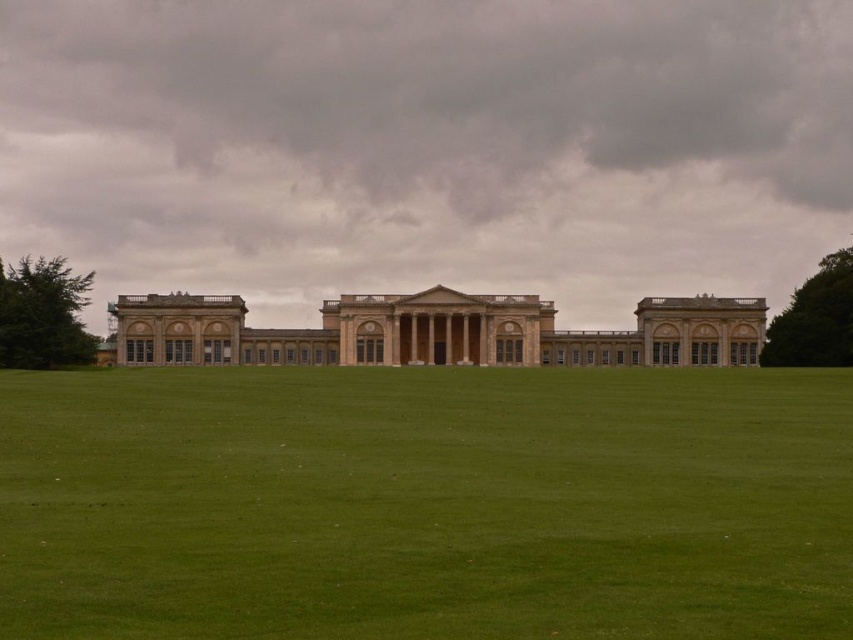
Question: Is the position of green grass at center less distant than that of beige stone mansion at center?

Choices:
 (A) yes
 (B) no

Answer: (A)

Question: In this image, where is green grass at center located relative to green leafy tree at right?

Choices:
 (A) below
 (B) above

Answer: (A)

Question: Which is farther from the green leafy tree at left?

Choices:
 (A) green leafy tree at right
 (B) beige stone mansion at center
 (C) green grass at center

Answer: (A)

Question: Based on their relative distances, which object is farther from the green leafy tree at left?

Choices:
 (A) beige stone mansion at center
 (B) green grass at center
 (C) green leafy tree at right

Answer: (C)

Question: Where is beige stone mansion at center located in relation to green leafy tree at right in the image?

Choices:
 (A) right
 (B) left

Answer: (B)

Question: Which object is farther from the camera taking this photo?

Choices:
 (A) beige stone mansion at center
 (B) green leafy tree at right
 (C) green grass at center

Answer: (B)